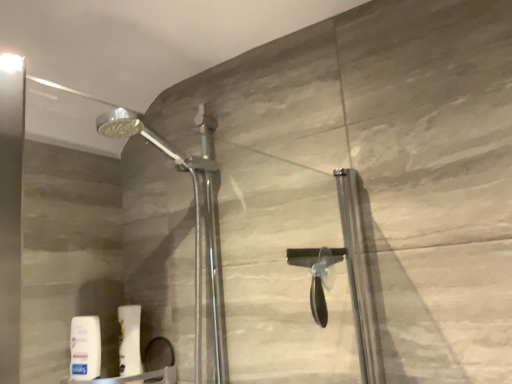
Question: Is white matte lotion at lower left, arranged as the first toiletry when viewed from the left, wider or thinner than white matte tube at lower left, the first toiletry positioned from the right?

Choices:
 (A) thin
 (B) wide

Answer: (A)

Question: From a real-world perspective, is white matte lotion at lower left, arranged as the first toiletry when viewed from the left, physically located above or below white matte tube at lower left, the first toiletry positioned from the right?

Choices:
 (A) above
 (B) below

Answer: (B)

Question: Estimate the real-world distances between objects in this image. Which object is closer to the white matte tube at lower left, the second toiletry in the left-to-right sequence?

Choices:
 (A) transparent glass door at center
 (B) white matte lotion at lower left, arranged as the first toiletry when viewed from the left

Answer: (B)

Question: Estimate the real-world distances between objects in this image. Which object is closer to the white matte lotion at lower left, which is the second toiletry in right-to-left order?

Choices:
 (A) transparent glass door at center
 (B) white matte tube at lower left, the first toiletry positioned from the right

Answer: (B)